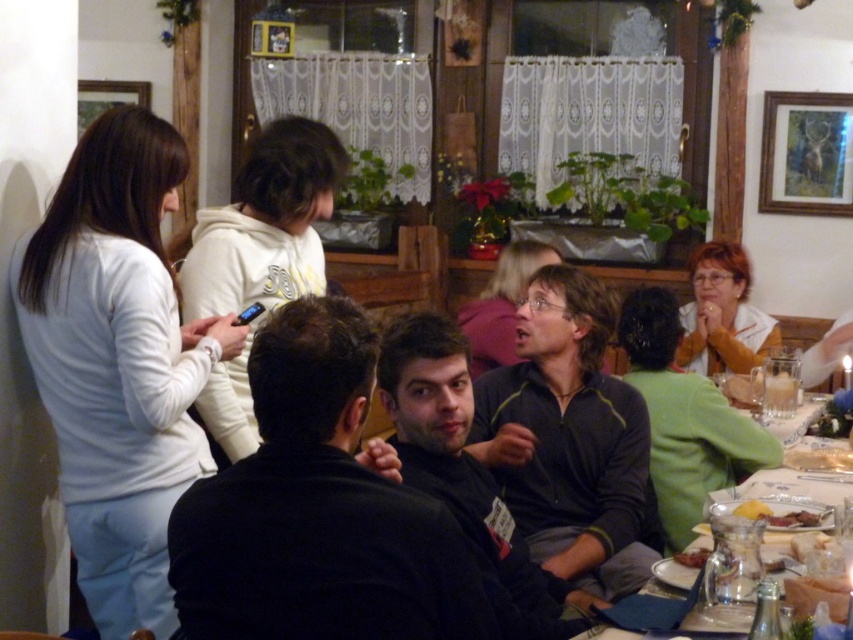
Does green sweater at right have a greater width compared to white matte shirt at lower right?

Incorrect, green sweater at right's width does not surpass white matte shirt at lower right's.

Does point (660, 300) come behind point (762, 349)?

No, (660, 300) is in front of (762, 349).

The width and height of the screenshot is (853, 640). In order to click on green sweater at right in this screenshot , I will do `click(683, 419)`.

Is point (601, 397) positioned after point (769, 518)?

Yes, it is behind point (769, 518).

Measure the distance between dark green fabric shirt at center and camera.

dark green fabric shirt at center and camera are 2.05 meters apart from each other.

Between point (598, 589) and point (749, 500), which one is positioned behind?

Positioned behind is point (749, 500).

I want to click on dark green fabric shirt at center, so click(570, 440).

Does white fleece hoodie at upper left have a lesser height compared to yellow matte plate at lower right?

No, white fleece hoodie at upper left is not shorter than yellow matte plate at lower right.

Which is in front, point (253, 156) or point (746, 506)?

Point (746, 506) is more forward.

Where is `white fleece hoodie at upper left`? This screenshot has height=640, width=853. white fleece hoodie at upper left is located at coordinates (264, 225).